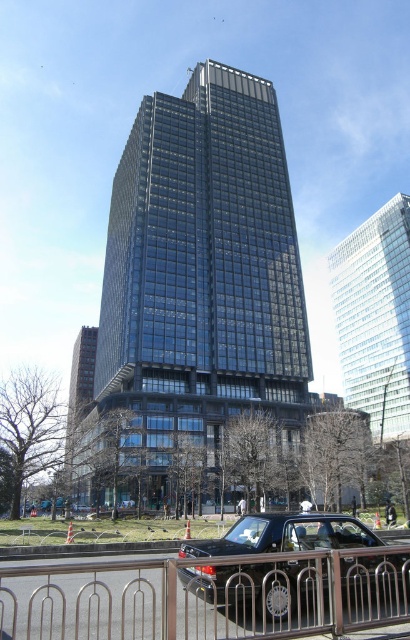
Question: Does glassy black skyscraper at center come in front of shiny black car at center?

Choices:
 (A) yes
 (B) no

Answer: (B)

Question: Among these points, which one is farthest from the camera?

Choices:
 (A) (75, 564)
 (B) (172, 209)
 (C) (81, 403)
 (D) (350, 291)

Answer: (D)

Question: Which point is closer to the camera?

Choices:
 (A) shiny black car at center
 (B) stainless steel fence at lower center
 (C) clear glass skyscraper at upper center
 (D) brown glass building at lower left

Answer: (B)

Question: Which object is positioned closest to the clear glass skyscraper at upper center?

Choices:
 (A) glassy black skyscraper at center
 (B) stainless steel fence at lower center

Answer: (A)

Question: Can you confirm if shiny black car at center is thinner than brown glass building at lower left?

Choices:
 (A) yes
 (B) no

Answer: (A)

Question: Can you confirm if stainless steel fence at lower center is positioned below shiny black car at center?

Choices:
 (A) no
 (B) yes

Answer: (B)